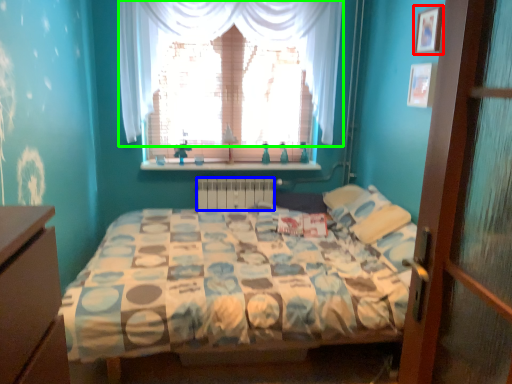
Question: Which is nearer to the picture frame (highlighted by a red box)? radiator (highlighted by a blue box) or curtain (highlighted by a green box).

Choices:
 (A) radiator
 (B) curtain

Answer: (B)